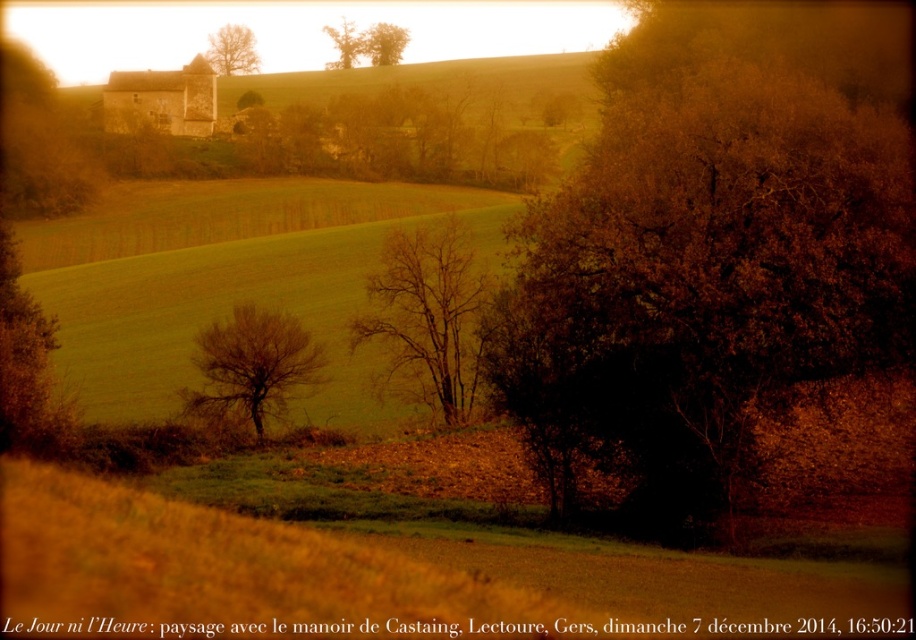
Between brown textured tree at center and smooth brown tree at upper center, which one has more height?

smooth brown tree at upper center is taller.

Looking at this image, between brown textured tree at center and smooth brown tree at upper center, which one has less height?

Standing shorter between the two is brown textured tree at center.

What are the coordinates of `brown textured tree at center` in the screenshot? It's located at (707, 257).

Based on the photo, between brown leafless tree at center and brown textured tree at upper center, which one has more height?

brown textured tree at upper center is taller.

Does brown leafless tree at center lie in front of brown textured tree at upper center?

Yes, it is in front of brown textured tree at upper center.

Which is behind, point (231, 362) or point (236, 100)?

The point (236, 100) is behind.

Where is `brown leafless tree at center`? The height and width of the screenshot is (640, 916). brown leafless tree at center is located at coordinates (252, 365).

Which is more to the left, green leafy tree at upper center or brown textured tree at upper center?

brown textured tree at upper center

Between green leafy tree at upper center and brown textured tree at upper center, which one appears on the right side from the viewer's perspective?

Answer: green leafy tree at upper center

Does point (379, 32) come behind point (249, 106)?

Yes, point (379, 32) is farther from viewer.

Locate an element on the screen. green leafy tree at upper center is located at coordinates (384, 44).